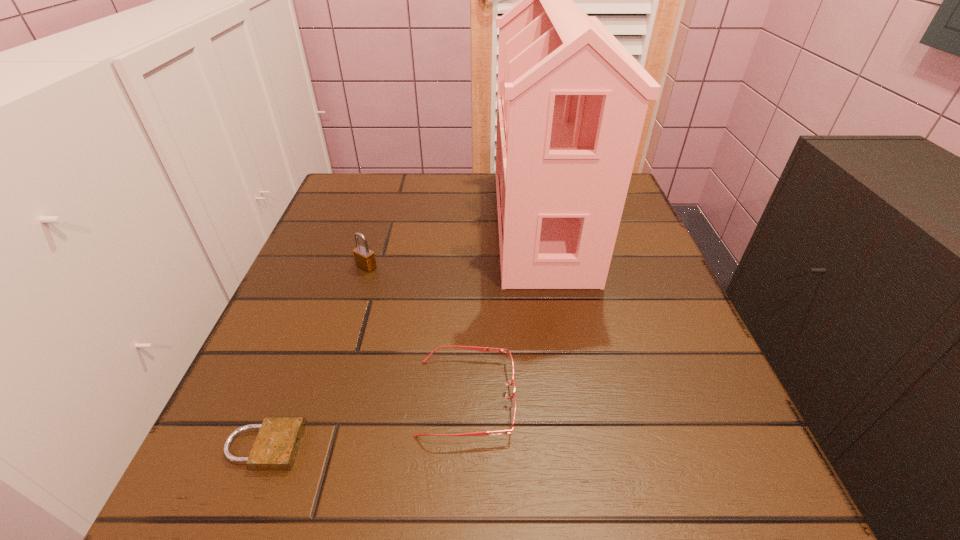
You are a GUI agent. You are given a task and a screenshot of the screen. Output one action in this format:
    pyautogui.click(x=<x>, y=<y>)
    Task: Click on the vacant space located 0.110m on the lenses of the third tallest object
    This screenshot has height=540, width=960.
    Given the screenshot: What is the action you would take?
    pyautogui.click(x=587, y=397)

You are a GUI agent. You are given a task and a screenshot of the screen. Output one action in this format:
    pyautogui.click(x=<x>, y=<y>)
    Task: Click on the vacant area situated on the keyhole side of the shorter padlock
    The height and width of the screenshot is (540, 960).
    Given the screenshot: What is the action you would take?
    pyautogui.click(x=543, y=446)

Where is `object that is at the far edge`? This screenshot has height=540, width=960. object that is at the far edge is located at coordinates (571, 104).

Find the location of `object that is at the near edge`. object that is at the near edge is located at coordinates (275, 448).

Where is `object located in the right edge section of the desktop`? object located in the right edge section of the desktop is located at coordinates (571, 104).

Locate an element on the screen. Image resolution: width=960 pixels, height=540 pixels. object that is positioned at the near left corner is located at coordinates (275, 448).

The height and width of the screenshot is (540, 960). What are the coordinates of `object present at the far right corner` in the screenshot? It's located at (571, 104).

In the image, there is a desktop. At what (x,y) coordinates should I click in order to perform the action: click on vacant space at the far edge. Please return your answer as a coordinate pair (x, y). The height and width of the screenshot is (540, 960). Looking at the image, I should click on (439, 177).

You are a GUI agent. You are given a task and a screenshot of the screen. Output one action in this format:
    pyautogui.click(x=<x>, y=<y>)
    Task: Click on the vacant space at the near edge of the desktop
    
    Given the screenshot: What is the action you would take?
    pyautogui.click(x=348, y=461)

You are a GUI agent. You are given a task and a screenshot of the screen. Output one action in this format:
    pyautogui.click(x=<x>, y=<y>)
    Task: Click on the free region at the left edge
    The image size is (960, 540).
    Given the screenshot: What is the action you would take?
    pyautogui.click(x=279, y=388)